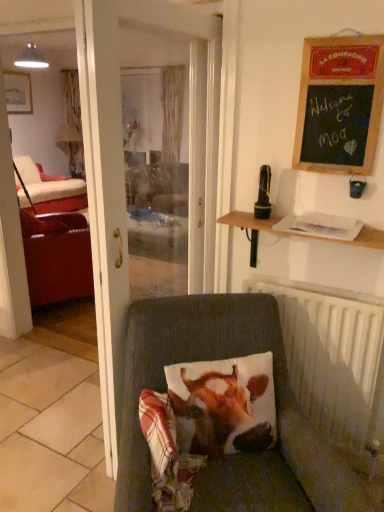
Question: From the image's perspective, relative to velvet cushion at lower center, is printed fabric cow at center above or below?

Choices:
 (A) below
 (B) above

Answer: (B)

Question: Would you say printed fabric cow at center is inside or outside velvet cushion at lower center?

Choices:
 (A) outside
 (B) inside

Answer: (B)

Question: Estimate the real-world distances between objects in this image. Which object is closer to the black rubberized phone at upper right?

Choices:
 (A) white metallic radiator at lower right
 (B) leather couch at left
 (C) printed fabric cow at center
 (D) velvet cushion at lower center
 (E) white glossy door at center

Answer: (A)

Question: Estimate the real-world distances between objects in this image. Which object is farther from the white metallic radiator at lower right?

Choices:
 (A) printed fabric cow at center
 (B) black rubberized phone at upper right
 (C) velvet cushion at lower center
 (D) black chalkboard at upper right
 (E) white glossy door at center

Answer: (E)